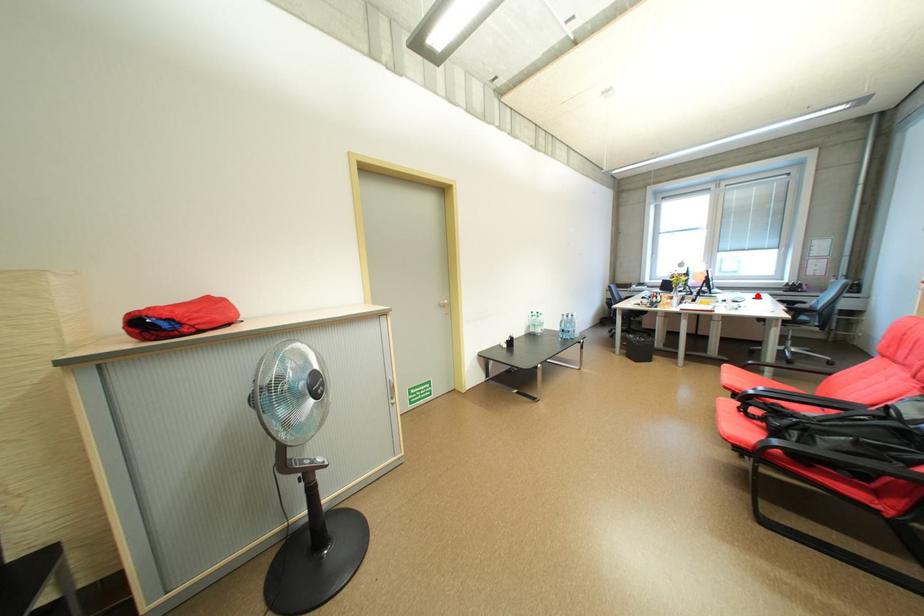
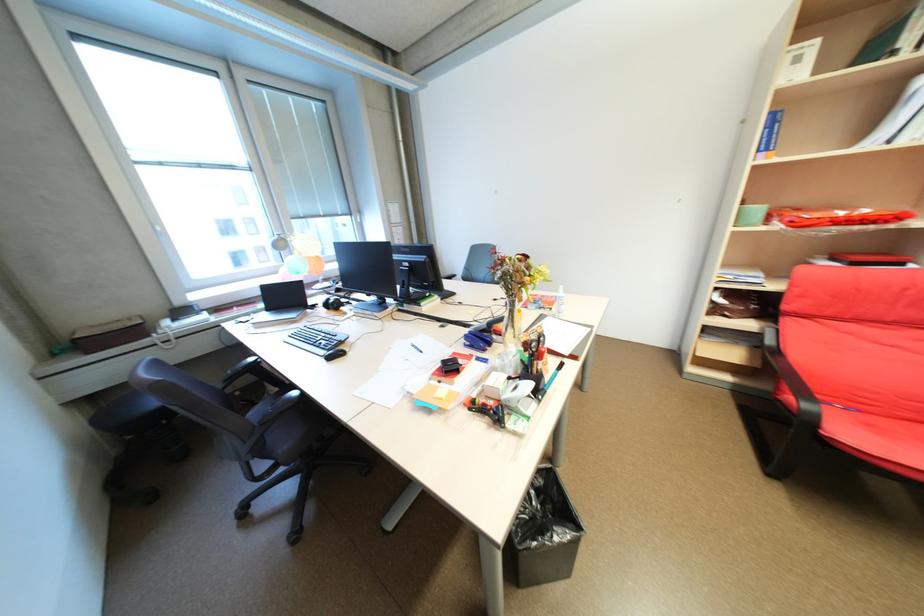
Question: I am providing you with two images of the same scene from different viewpoints. A red point is marked on the first image. Is the red point's position out of view in image 2?

Choices:
 (A) Yes
 (B) No

Answer: (A)